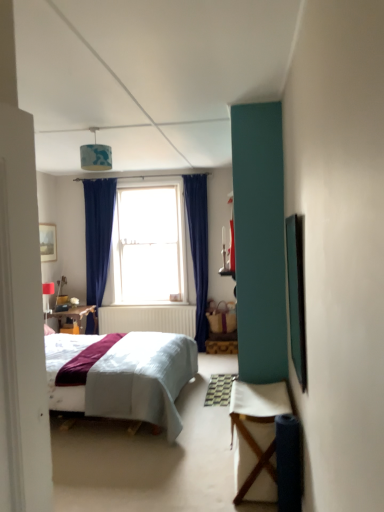
Describe the element at coordinates (48, 242) in the screenshot. The image size is (384, 512). I see `wooden framed picture at upper left` at that location.

This screenshot has height=512, width=384. What do you see at coordinates (48, 288) in the screenshot?
I see `matte white lampshade at upper left, arranged as the second lamp when viewed from the right` at bounding box center [48, 288].

Locate an element on the screen. clear glass window at center is located at coordinates (149, 244).

Would you consider matte white lampshade at upper left, arranged as the second lamp when viewed from the right, to be distant from wooden framed picture at upper left?

No, there isn't a large distance between matte white lampshade at upper left, arranged as the second lamp when viewed from the right, and wooden framed picture at upper left.

Consider the image. Which object is further away from the camera taking this photo, matte white lampshade at upper left, acting as the 1th lamp starting from the bottom, or wooden framed picture at upper left?

matte white lampshade at upper left, acting as the 1th lamp starting from the bottom, is more distant.

From a real-world perspective, does matte white lampshade at upper left, which is counted as the second lamp, starting from the top, stand above wooden framed picture at upper left?

Incorrect, from a real-world perspective, matte white lampshade at upper left, which is counted as the second lamp, starting from the top, is lower than wooden framed picture at upper left.

Looking at the image, does matte white lampshade at upper left, acting as the 1th lamp starting from the bottom, seem bigger or smaller compared to wooden framed picture at upper left?

Clearly, matte white lampshade at upper left, acting as the 1th lamp starting from the bottom, is smaller in size than wooden framed picture at upper left.

Which object is closer to the camera taking this photo, blue fabric lampshade at upper center, which is counted as the first lamp, starting from the front, or white fabric table at lower right?

white fabric table at lower right is more forward.

From a real-world perspective, is blue fabric lampshade at upper center, positioned as the 1th lamp in right-to-left order, physically below white fabric table at lower right?

No, from a real-world perspective, blue fabric lampshade at upper center, positioned as the 1th lamp in right-to-left order, is not beneath white fabric table at lower right.

Can you tell me how much blue fabric lampshade at upper center, positioned as the 1th lamp in right-to-left order, and white fabric table at lower right differ in facing direction?

There is a 90.2-degree angle between the facing directions of blue fabric lampshade at upper center, positioned as the 1th lamp in right-to-left order, and white fabric table at lower right.

From the image's perspective, does blue fabric lampshade at upper center, positioned as the 1th lamp in right-to-left order, appear lower than white fabric table at lower right?

Incorrect, from the image's perspective, blue fabric lampshade at upper center, positioned as the 1th lamp in right-to-left order, is higher than white fabric table at lower right.

Does wooden framed picture at upper left have a smaller size compared to blue fabric lampshade at upper center, which is counted as the first lamp, starting from the front?

Correct, wooden framed picture at upper left occupies less space than blue fabric lampshade at upper center, which is counted as the first lamp, starting from the front.

Can you confirm if wooden framed picture at upper left is positioned to the left of blue fabric lampshade at upper center, acting as the second lamp starting from the back?

Correct, you'll find wooden framed picture at upper left to the left of blue fabric lampshade at upper center, acting as the second lamp starting from the back.

Consider the image. From the image's perspective, is wooden framed picture at upper left positioned above or below blue fabric lampshade at upper center, which is counted as the first lamp, starting from the front?

Based on their image positions, wooden framed picture at upper left is located beneath blue fabric lampshade at upper center, which is counted as the first lamp, starting from the front.

Does point (51, 246) come in front of point (109, 151)?

No, it is not.

Is point (54, 260) positioned in front of point (259, 417)?

No, (54, 260) is further to viewer.

Between wooden framed picture at upper left and white fabric table at lower right, which one has smaller width?

With smaller width is wooden framed picture at upper left.

Is wooden framed picture at upper left shorter than white fabric table at lower right?

Yes.

From a real-world perspective, is wooden framed picture at upper left below white fabric table at lower right?

Actually, wooden framed picture at upper left is physically above white fabric table at lower right in the real world.

Is clear glass window at center situated inside matte white lampshade at upper left, which is the 2th lamp from front to back, or outside?

The correct answer is: outside.

From a real-world perspective, between clear glass window at center and matte white lampshade at upper left, the first lamp positioned from the back, who is vertically higher?

clear glass window at center.

From the image's perspective, relative to matte white lampshade at upper left, which is the first lamp from left to right, is clear glass window at center above or below?

Clearly, from the image's perspective, clear glass window at center is above matte white lampshade at upper left, which is the first lamp from left to right.

Who is shorter, clear glass window at center or matte white lampshade at upper left, acting as the 1th lamp starting from the bottom?

With less height is matte white lampshade at upper left, acting as the 1th lamp starting from the bottom.

Considering the positions of objects wooden framed picture at upper left and clear glass window at center in the image provided, who is more to the right, wooden framed picture at upper left or clear glass window at center?

clear glass window at center.

In the scene shown: Is wooden framed picture at upper left looking in the opposite direction of clear glass window at center?

No.

From the image's perspective, between wooden framed picture at upper left and clear glass window at center, which one is located above?

clear glass window at center is shown above in the image.

Is white fabric table at lower right oriented towards clear glass window at center?

No, white fabric table at lower right is not aimed at clear glass window at center.

Based on the photo, looking at their sizes, would you say white fabric table at lower right is wider or thinner than clear glass window at center?

white fabric table at lower right is wider than clear glass window at center.

Is white fabric table at lower right smaller than clear glass window at center?

Yes, white fabric table at lower right is smaller than clear glass window at center.

Does point (274, 470) come in front of point (155, 188)?

That is True.

This screenshot has height=512, width=384. In order to click on picture frame located above the matte white lampshade at upper left, which is the 2th lamp from front to back (from a real-world perspective) in this screenshot , I will do `click(48, 242)`.

I want to click on table in front of the blue fabric lampshade at upper center, arranged as the 2th lamp when ordered from the bottom, so click(256, 437).

Estimate the real-world distances between objects in this image. Which object is further from matte white lampshade at upper left, acting as the 1th lamp starting from the bottom, blue fabric lampshade at upper center, the first lamp from the top, or wooden framed picture at upper left?

blue fabric lampshade at upper center, the first lamp from the top, is positioned further to the anchor matte white lampshade at upper left, acting as the 1th lamp starting from the bottom.

Based on their spatial positions, is clear glass window at center or blue fabric lampshade at upper center, the first lamp from the top, further from wooden framed picture at upper left?

blue fabric lampshade at upper center, the first lamp from the top, is positioned further to the anchor wooden framed picture at upper left.

Based on their spatial positions, is matte white lampshade at upper left, the first lamp positioned from the back, or white fabric table at lower right closer to wooden framed picture at upper left?

The object closer to wooden framed picture at upper left is matte white lampshade at upper left, the first lamp positioned from the back.

Consider the image. Based on their spatial positions, is matte white lampshade at upper left, which is the first lamp from left to right, or clear glass window at center further from blue fabric lampshade at upper center, acting as the second lamp starting from the back?

matte white lampshade at upper left, which is the first lamp from left to right, lies further to blue fabric lampshade at upper center, acting as the second lamp starting from the back, than the other object.

When comparing their distances from wooden framed picture at upper left, does blue fabric lampshade at upper center, positioned as the 1th lamp in right-to-left order, or matte white lampshade at upper left, which is the 2th lamp from front to back, seem closer?

matte white lampshade at upper left, which is the 2th lamp from front to back, is positioned closer to the anchor wooden framed picture at upper left.

Looking at this image, estimate the real-world distances between objects in this image. Which object is closer to blue fabric lampshade at upper center, arranged as the 2th lamp when ordered from the bottom, matte white lampshade at upper left, the first lamp positioned from the back, or white fabric table at lower right?

matte white lampshade at upper left, the first lamp positioned from the back, is closer to blue fabric lampshade at upper center, arranged as the 2th lamp when ordered from the bottom.

Looking at the image, which one is located closer to wooden framed picture at upper left, matte white lampshade at upper left, acting as the 1th lamp starting from the bottom, or blue fabric lampshade at upper center, acting as the second lamp starting from the left?

Based on the image, matte white lampshade at upper left, acting as the 1th lamp starting from the bottom, appears to be nearer to wooden framed picture at upper left.

Estimate the real-world distances between objects in this image. Which object is closer to clear glass window at center, matte white lampshade at upper left, which is the 2th lamp from front to back, or white fabric table at lower right?

Based on the image, matte white lampshade at upper left, which is the 2th lamp from front to back, appears to be nearer to clear glass window at center.

Find the location of a particular element. The height and width of the screenshot is (512, 384). lamp between blue fabric lampshade at upper center, which is counted as the first lamp, starting from the front, and clear glass window at center from front to back is located at coordinates (48, 288).

Locate an element on the screen. The width and height of the screenshot is (384, 512). picture frame positioned between white fabric table at lower right and clear glass window at center from near to far is located at coordinates (48, 242).

Locate an element on the screen. The height and width of the screenshot is (512, 384). picture frame between white fabric table at lower right and matte white lampshade at upper left, the first lamp positioned from the back, along the z-axis is located at coordinates (48, 242).

Identify the location of lamp located between white fabric table at lower right and wooden framed picture at upper left in the depth direction. The height and width of the screenshot is (512, 384). (95, 155).